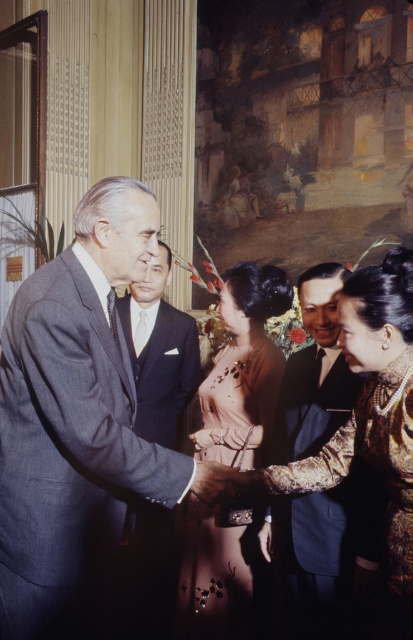
Is dark gray wool suit at left shorter than dark blue suit at center?

In fact, dark gray wool suit at left may be taller than dark blue suit at center.

Can you confirm if dark gray wool suit at left is positioned above dark blue suit at center?

Incorrect, dark gray wool suit at left is not positioned above dark blue suit at center.

What are the coordinates of `dark gray wool suit at left` in the screenshot? It's located at [68, 456].

Consider the image. Can you confirm if dark gray wool suit at left is taller than matte gold bracelet at lower center?

Indeed, dark gray wool suit at left has a greater height compared to matte gold bracelet at lower center.

From the picture: Who is positioned more to the right, dark gray wool suit at left or matte gold bracelet at lower center?

matte gold bracelet at lower center

Who is more forward, (49,276) or (227,476)?

Point (49,276) is more forward.

At what (x,y) coordinates should I click in order to perform the action: click on dark gray wool suit at left. Please return your answer as a coordinate pair (x, y). Looking at the image, I should click on (68, 456).

Is dark gray wool suit at left below gold textured suit at center?

Incorrect, dark gray wool suit at left is not positioned below gold textured suit at center.

Can you confirm if dark gray wool suit at left is positioned to the right of gold textured suit at center?

Incorrect, dark gray wool suit at left is not on the right side of gold textured suit at center.

Between point (173, 464) and point (318, 301), which one is positioned behind?

Positioned behind is point (318, 301).

What are the coordinates of `dark gray wool suit at left` in the screenshot? It's located at (68, 456).